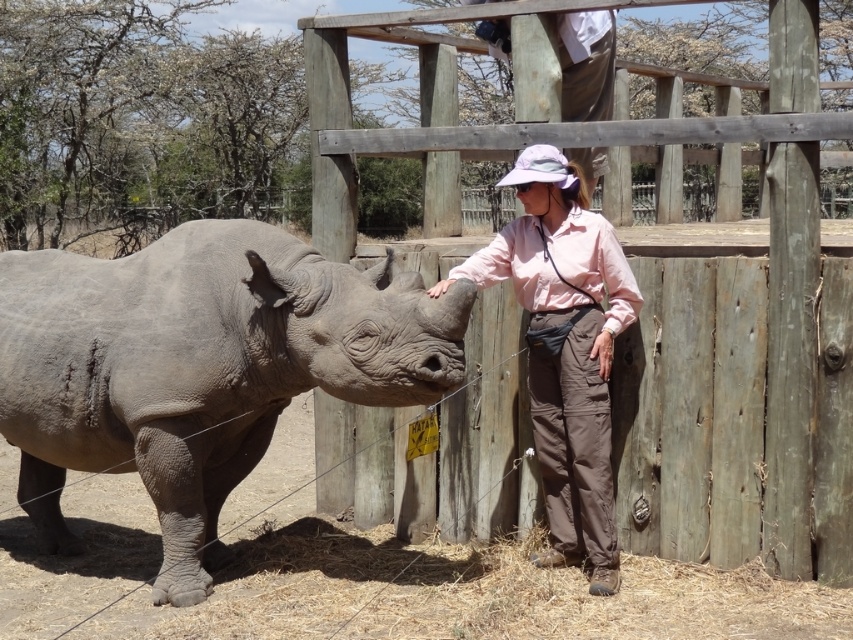
You are a zookeeper who needs to ensure that the gray matte rhinoceros at left and the pink fabric shirt at center are visible to visitors. Given their sizes, which object should you place closer to the viewing area?

The gray matte rhinoceros at left is bigger than the pink fabric shirt at center, so the pink fabric shirt at center should be placed closer to the viewing area to ensure it is visible to visitors.

You are standing at the entrance of the sanctuary and want to locate the person wearing the pink fabric shirt at center. According to the coordinates, where should you look relative to the rhinoceros?

The pink fabric shirt at center is located at coordinates point (564, 348), which means it is positioned slightly to the right and above the center of the image. Since the rhinoceros is in the foreground, the person is likely standing near the wooden fence to the right side of the rhino.

You are standing at the point labeled as point (199, 368) in the image. What object is located at that point?

The point (199, 368) indicates the gray matte rhinoceros at left.